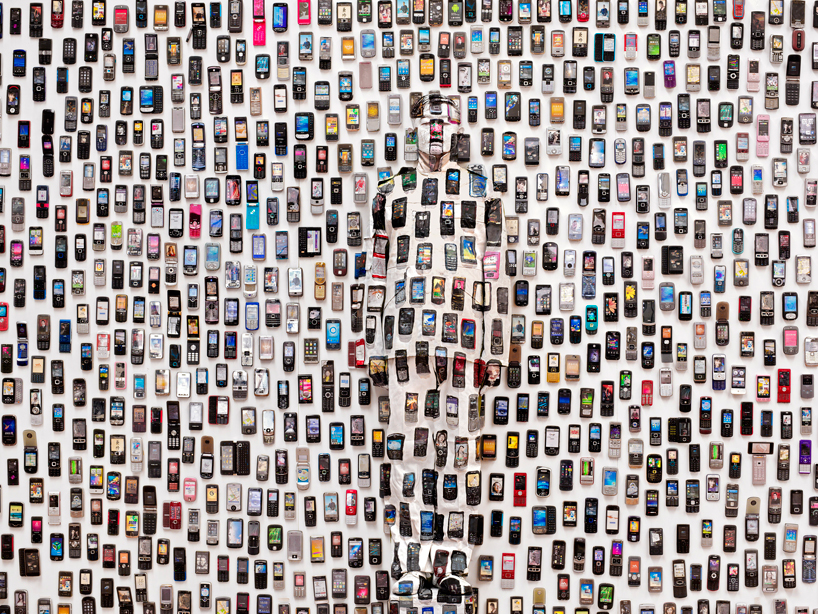
Find the location of a particular element. The width and height of the screenshot is (818, 614). phone is located at coordinates (617, 565).